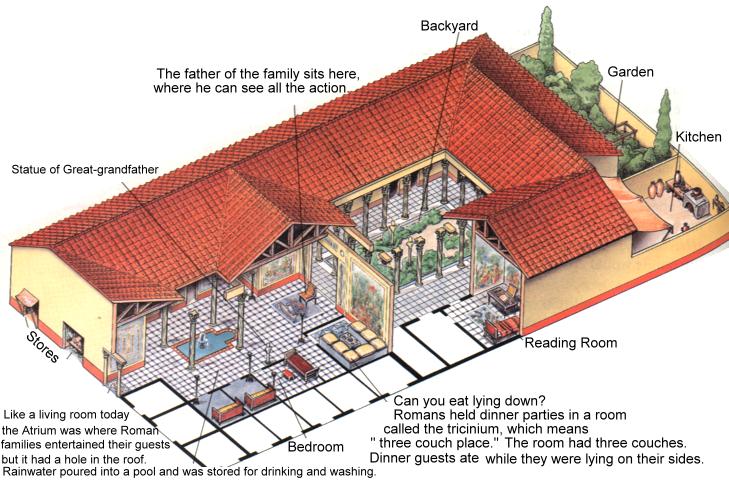
Identify the location of 2 types of flooring. (440, 348), (413, 292).